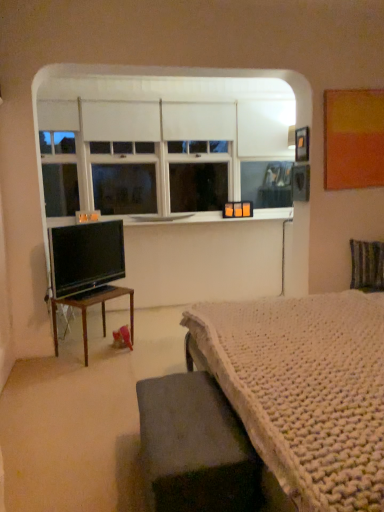
Question: Is white knitted blanket at lower right oriented towards dark gray fabric ottoman at lower center, the 1th table positioned from the right?

Choices:
 (A) no
 (B) yes

Answer: (A)

Question: Does white knitted blanket at lower right appear on the left side of dark gray fabric ottoman at lower center, the 1th table positioned from the right?

Choices:
 (A) no
 (B) yes

Answer: (A)

Question: Is white knitted blanket at lower right taller than dark gray fabric ottoman at lower center, the 1th table positioned from the right?

Choices:
 (A) no
 (B) yes

Answer: (A)

Question: Is white knitted blanket at lower right wider than dark gray fabric ottoman at lower center, the first table viewed from the front?

Choices:
 (A) yes
 (B) no

Answer: (A)

Question: Could dark gray fabric ottoman at lower center, the second table viewed from the left, be considered to be inside white knitted blanket at lower right?

Choices:
 (A) no
 (B) yes

Answer: (A)

Question: Are white knitted blanket at lower right and dark gray fabric ottoman at lower center, the first table viewed from the front, making contact?

Choices:
 (A) no
 (B) yes

Answer: (A)

Question: From a real-world perspective, is wooden table at left, which appears as the second table when viewed from the right, on black glossy tv at left?

Choices:
 (A) yes
 (B) no

Answer: (B)

Question: Is wooden table at left, acting as the second table starting from the front, positioned before black glossy tv at left?

Choices:
 (A) no
 (B) yes

Answer: (A)

Question: Considering the relative sizes of wooden table at left, placed as the 1th table when sorted from back to front, and black glossy tv at left in the image provided, is wooden table at left, placed as the 1th table when sorted from back to front, smaller than black glossy tv at left?

Choices:
 (A) yes
 (B) no

Answer: (B)

Question: Can you confirm if wooden table at left, which is counted as the first table, starting from the left, is wider than black glossy tv at left?

Choices:
 (A) yes
 (B) no

Answer: (A)

Question: Could you tell me if wooden table at left, placed as the 1th table when sorted from back to front, is facing black glossy tv at left?

Choices:
 (A) yes
 (B) no

Answer: (B)

Question: Is wooden table at left, which is counted as the first table, starting from the left, at the right side of black glossy tv at left?

Choices:
 (A) yes
 (B) no

Answer: (A)

Question: From the image's perspective, is striped fabric swivel chair at right over wooden table at left, which appears as the second table when viewed from the right?

Choices:
 (A) no
 (B) yes

Answer: (B)